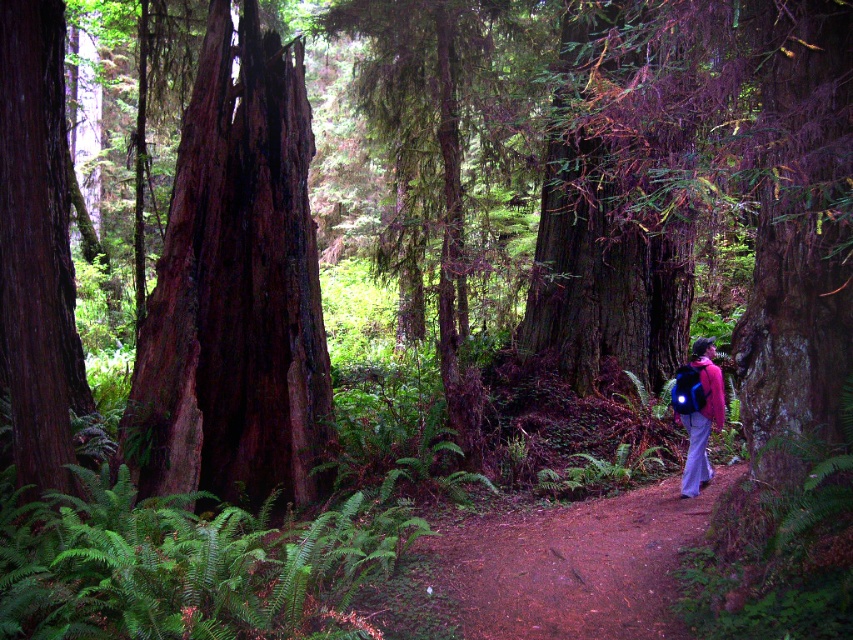
Based on the photo, you are standing in the middle of a dense forest and notice a specific point marked at coordinates (602, 221). Can you identify what is located exactly at that point?

At point (602, 221) lies the dark brown bark tree at center.